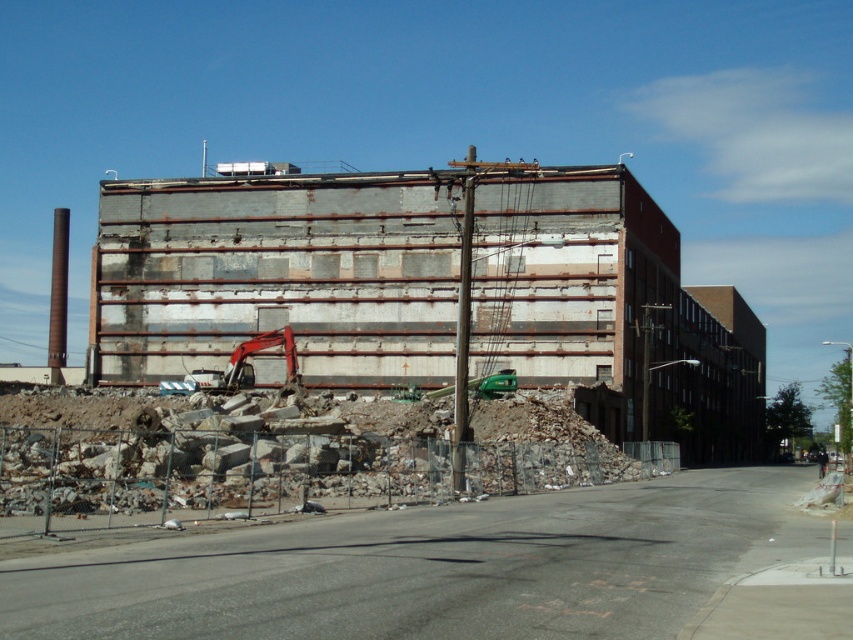
You are a construction worker who needs to move a heavy equipment from the site. The rusty metal building at center is in the way. Can you move the orange metallic excavator at center around it?

The rusty metal building at center is bigger than the orange metallic excavator at center, but since the excavator is a movable machine, it can be maneuvered around the building if there is enough space. However, the description does not provide information about the available space or the building structure, so it is unclear if the orange metallic excavator at center can be moved around the rusty metal building at center.

You are a construction worker planning to move a 10 meter wide crane into the space between the rusty metal building at center and the orange metallic excavator at center. Can the crane fit there based on their widths?

The rusty metal building at center might be wider than orange metallic excavator at center, so it is uncertain if the 10 meter wide crane can fit between them without knowing their exact widths.